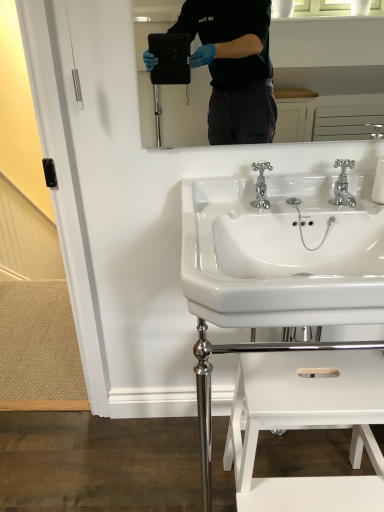
Where is `blank space situated above white glossy step stool at lower center (from a real-world perspective)`? blank space situated above white glossy step stool at lower center (from a real-world perspective) is located at coordinates (316, 380).